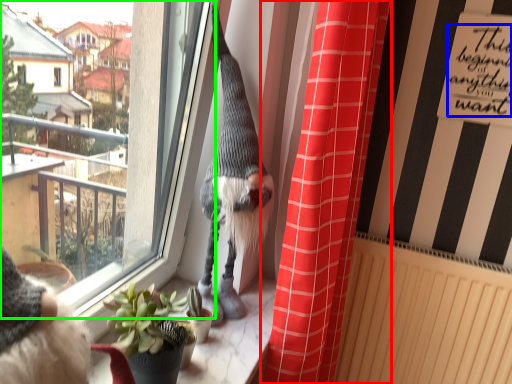
Question: Estimate the real-world distances between objects in this image. Which object is closer to curtain (highlighted by a red box), writing (highlighted by a blue box) or window (highlighted by a green box)?

Choices:
 (A) writing
 (B) window

Answer: (A)